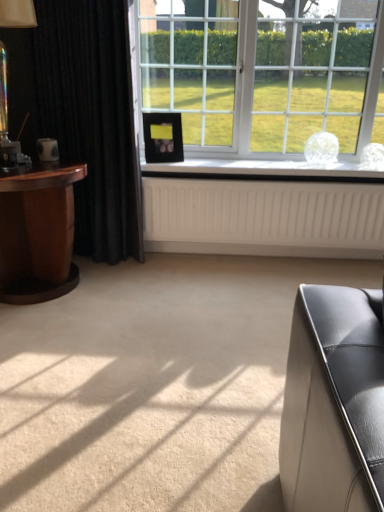
Question: From a real-world perspective, relative to clear glass vase at center, is clear glass window at center vertically above or below?

Choices:
 (A) above
 (B) below

Answer: (A)

Question: Considering the positions of clear glass window at center and clear glass vase at center in the image, is clear glass window at center taller or shorter than clear glass vase at center?

Choices:
 (A) short
 (B) tall

Answer: (B)

Question: Which is farther from the clear glass window at center?

Choices:
 (A) mahogany wood side table at left
 (B) black velvet curtain at left
 (C) black matte picture frame at center
 (D) translucent glass table lamp at left
 (E) white textured radiator at center

Answer: (D)

Question: Which object is positioned closest to the mahogany wood side table at left?

Choices:
 (A) clear glass vase at center
 (B) black velvet curtain at left
 (C) black matte picture frame at center
 (D) clear glass window at center
 (E) translucent glass table lamp at left

Answer: (E)